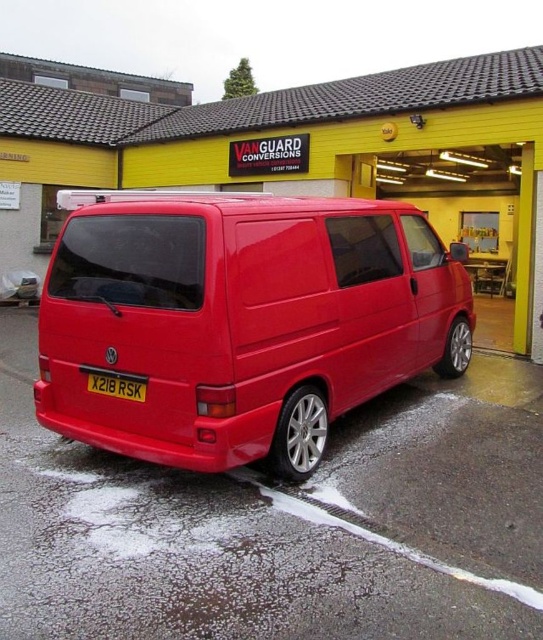
Please provide the 2D coordinates of the glossy red van at center in the image. The coordinates should be in the format of a tuple with two decimal numbers, such as 0.502 and 0.444. The coordinate system is normalized, where the origin is at the bottom left corner of the image, and the values range from 0 to 1 in both x and y directions. The x increases to the right, and y increases upwards. Please answer with the exact coordinates provided in the Objects Description.

The glossy red van at center is located at coordinates (241, 321).